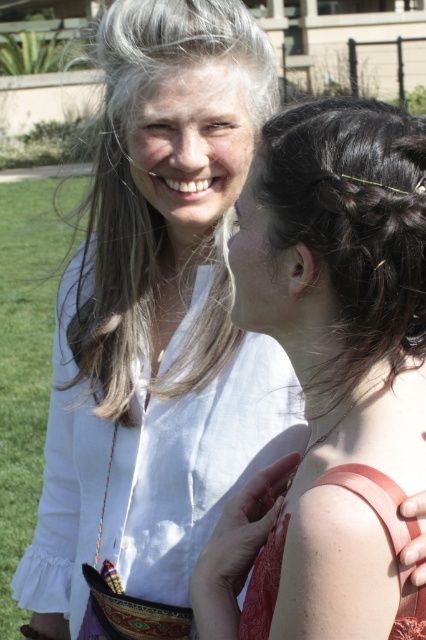
Question: Which of these objects is positioned closest to the white cotton shirt at upper center?

Choices:
 (A) matte red dress at center
 (B) matte coral fabric dress at lower right
 (C) grayhair at upper center

Answer: (C)

Question: Can you confirm if matte red dress at center is positioned to the left of grayhair at upper center?

Choices:
 (A) yes
 (B) no

Answer: (B)

Question: Which point is closer to the camera taking this photo?

Choices:
 (A) (52, 598)
 (B) (104, 323)
 (C) (324, 476)
 (D) (408, 593)

Answer: (D)

Question: Is matte red dress at center to the left of matte coral fabric dress at lower right from the viewer's perspective?

Choices:
 (A) yes
 (B) no

Answer: (B)

Question: Considering the relative positions of matte red dress at center and matte coral fabric dress at lower right in the image provided, where is matte red dress at center located with respect to matte coral fabric dress at lower right?

Choices:
 (A) right
 (B) left

Answer: (A)

Question: Considering the real-world distances, which object is closest to the white cotton shirt at upper center?

Choices:
 (A) matte red dress at center
 (B) matte coral fabric dress at lower right

Answer: (A)